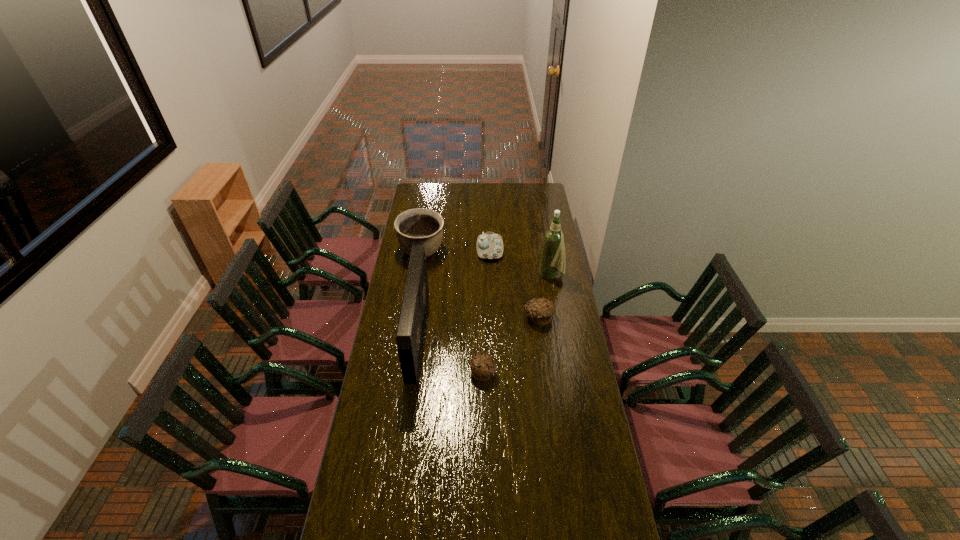
Identify the location of free space located on the back of the farther muffin. (531, 258).

Find the location of `free region located 0.340m on the front of the chinaware`. free region located 0.340m on the front of the chinaware is located at coordinates (492, 307).

This screenshot has width=960, height=540. I want to click on free space located on the back of the pottery, so click(x=429, y=208).

This screenshot has width=960, height=540. I want to click on vacant region located on the front-facing side of the wine bottle, so click(x=494, y=275).

Locate an element on the screen. free region located on the front-facing side of the wine bottle is located at coordinates (465, 275).

Find the location of a particular element. The image size is (960, 540). vacant region located 0.270m on the front-facing side of the wine bottle is located at coordinates (489, 275).

This screenshot has height=540, width=960. I want to click on vacant space located on the front side of the second tallest object, so click(x=499, y=334).

You are a GUI agent. You are given a task and a screenshot of the screen. Output one action in this format:
    pyautogui.click(x=<x>, y=<y>)
    Task: Click on the pottery present at the left edge
    
    Given the screenshot: What is the action you would take?
    pyautogui.click(x=415, y=227)

At what (x,y) coordinates should I click in order to perform the action: click on videotape present at the left edge. Please return your answer as a coordinate pair (x, y). Looking at the image, I should click on (409, 336).

Locate an element on the screen. The height and width of the screenshot is (540, 960). muffin that is at the right edge is located at coordinates (540, 310).